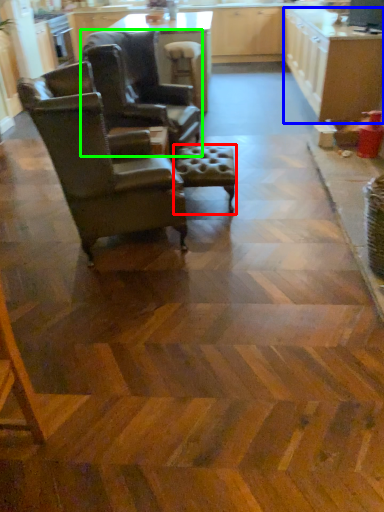
Question: Which is nearer to the bar stool (highlighted by a red box)? cabinetry (highlighted by a blue box) or chair (highlighted by a green box).

Choices:
 (A) cabinetry
 (B) chair

Answer: (B)